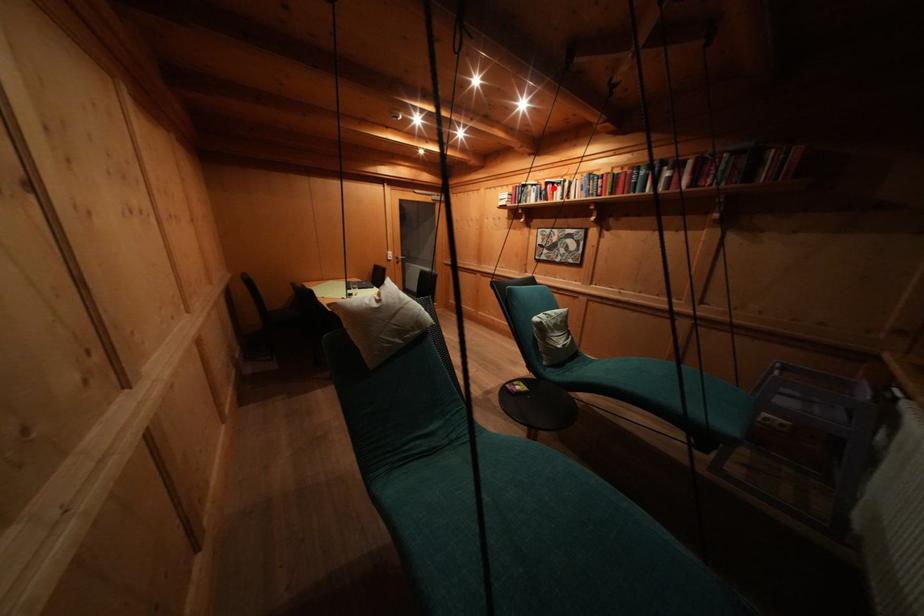
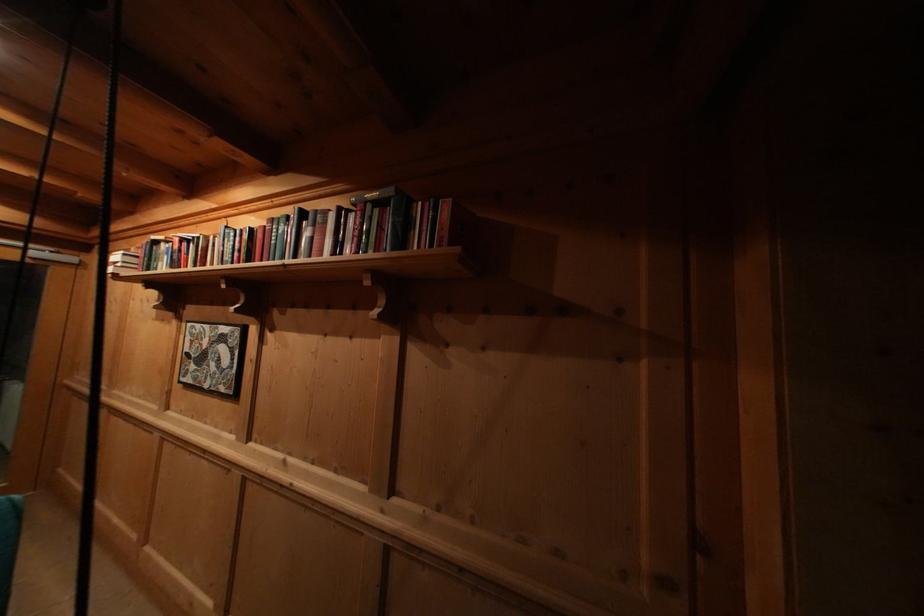
Question: A red point is marked in image1. In image2, is the corresponding 3D point closer to the camera or farther? Reply with the corresponding letter.

Choices:
 (A) The corresponding 3D point is closer.
 (B) The corresponding 3D point is farther.

Answer: (B)